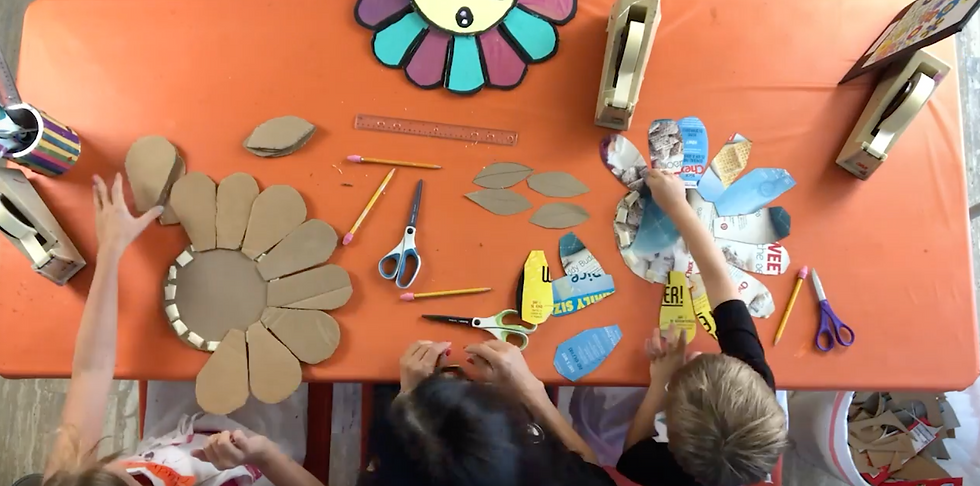
Locate an element on the screen. This screenshot has height=486, width=980. pencil cup is located at coordinates (63, 140).